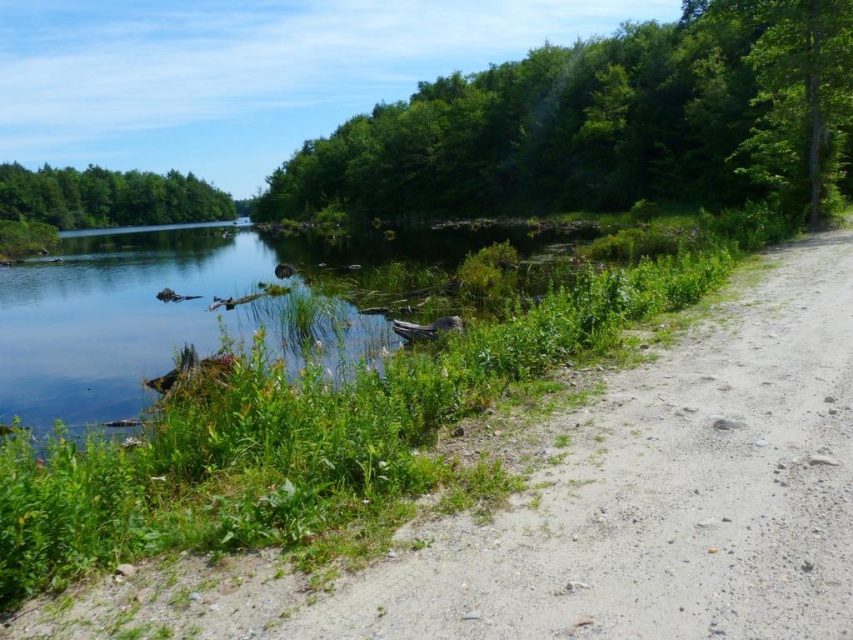
Is green leafy tree at upper right to the right of green matte tree at upper left from the viewer's perspective?

Yes, green leafy tree at upper right is to the right of green matte tree at upper left.

Based on the photo, is green leafy tree at upper right smaller than green matte tree at upper left?

Yes.

Does point (727, 20) come in front of point (120, 193)?

Yes, it is.

Locate an element on the screen. Image resolution: width=853 pixels, height=640 pixels. green leafy tree at upper right is located at coordinates (605, 125).